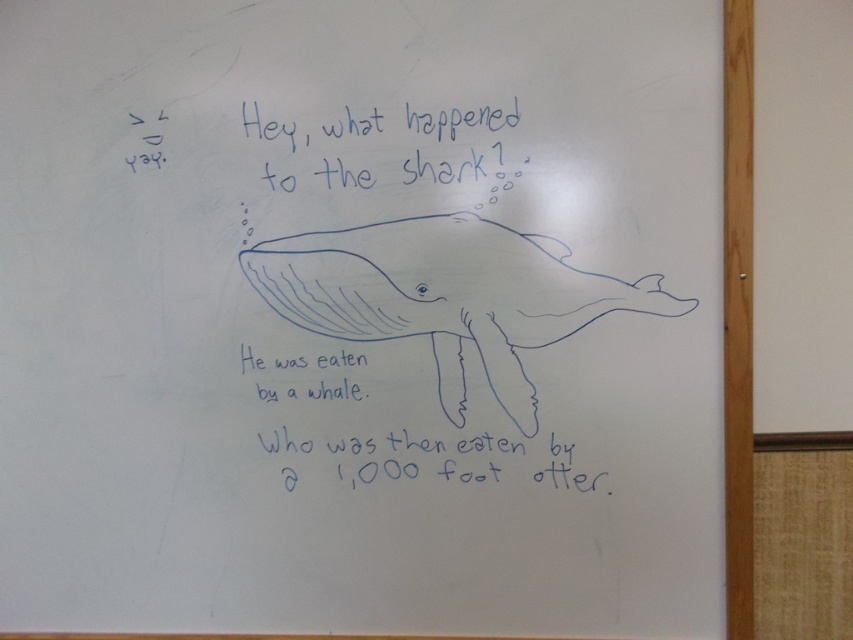
Is blue line drawing whale at center smaller than blue handwritten text at upper center?

Actually, blue line drawing whale at center might be larger than blue handwritten text at upper center.

Which of these two, blue line drawing whale at center or blue handwritten text at upper center, stands taller?

blue line drawing whale at center is taller.

Is point (276, 237) positioned after point (486, 116)?

Yes, point (276, 237) is behind point (486, 116).

Identify the location of blue line drawing whale at center. Image resolution: width=853 pixels, height=640 pixels. (447, 296).

Who is more distant from viewer, (529, 278) or (572, 472)?

The point (572, 472) is more distant.

Can you confirm if blue line drawing whale at center is positioned below blue ink text at center?

Incorrect, blue line drawing whale at center is not positioned below blue ink text at center.

Is point (318, 333) in front of point (311, 449)?

Yes, it is in front of point (311, 449).

This screenshot has width=853, height=640. I want to click on blue line drawing whale at center, so click(x=447, y=296).

Consider the image. Is blue ink text at center closer to camera compared to blue handwritten text at upper center?

No, blue ink text at center is further to the viewer.

Between blue ink text at center and blue handwritten text at upper center, which one has less height?

blue handwritten text at upper center is shorter.

Measure the distance between point (469, 403) and camera.

They are 1.39 meters apart.

The image size is (853, 640). I want to click on blue ink text at center, so click(x=444, y=420).